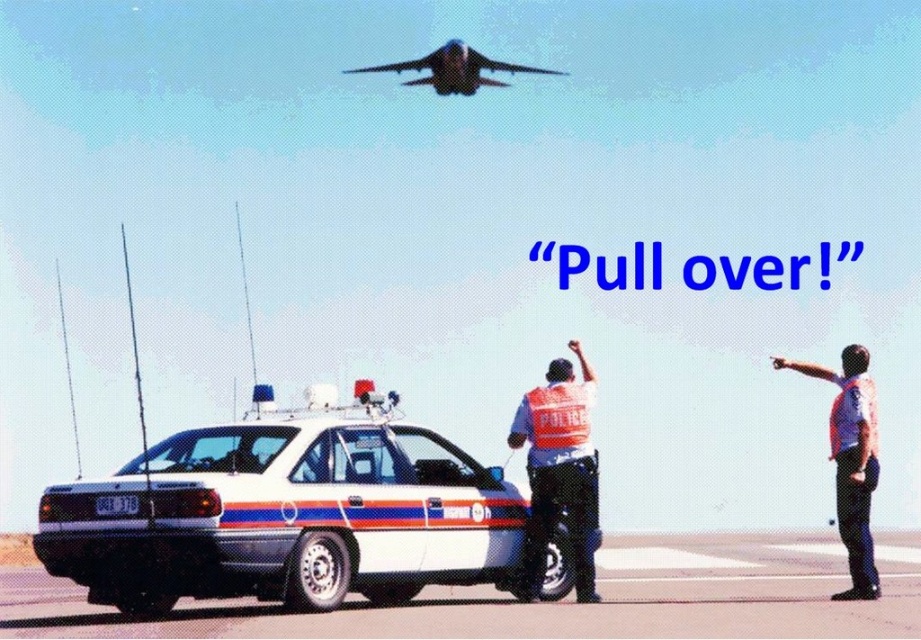
Between white glossy police car at center and reflective orange vest at center, which one is positioned higher?

reflective orange vest at center is above.

What do you see at coordinates (287, 513) in the screenshot? The width and height of the screenshot is (921, 640). I see `white glossy police car at center` at bounding box center [287, 513].

Is point (550, 586) behind point (575, 540)?

Yes, point (550, 586) is behind point (575, 540).

Image resolution: width=921 pixels, height=640 pixels. Find the location of `white glossy police car at center`. white glossy police car at center is located at coordinates (287, 513).

Does point (286, 440) come farther from viewer compared to point (421, 80)?

No, it is in front of (421, 80).

Can you confirm if white glossy police car at center is positioned above shiny blue jet at upper center?

Incorrect, white glossy police car at center is not positioned above shiny blue jet at upper center.

Find the location of a particular element. This screenshot has height=640, width=921. white glossy police car at center is located at coordinates (287, 513).

This screenshot has height=640, width=921. Identify the location of white glossy police car at center. (287, 513).

Is light blue uniform at center closer to the viewer compared to shiny blue jet at upper center?

Yes, light blue uniform at center is in front of shiny blue jet at upper center.

How far apart are light blue uniform at center and shiny blue jet at upper center?

They are 15.61 meters apart.

Identify the location of light blue uniform at center. (850, 460).

Find the location of a particular element. light blue uniform at center is located at coordinates (850, 460).